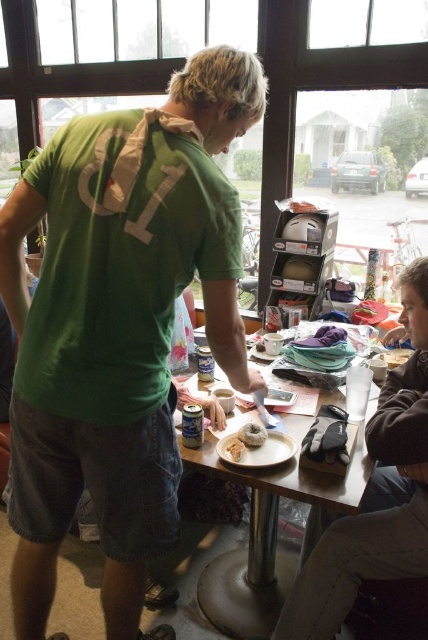
Who is lower down, green matte t-shirt at center or soft white bread at table center?

soft white bread at table center

Who is more forward, (109,632) or (255,429)?

Point (109,632)

You are a GUI agent. You are given a task and a screenshot of the screen. Output one action in this format:
    pyautogui.click(x=<x>, y=<y>)
    Task: Click on the green matte t-shirt at center
    This screenshot has height=640, width=428.
    Given the screenshot: What is the action you would take?
    pyautogui.click(x=118, y=324)

Does brown fuzzy sweater at lower right have a lesser height compared to smooth white bread at table center?

Incorrect, brown fuzzy sweater at lower right's height does not fall short of smooth white bread at table center's.

Is point (412, 429) behind point (229, 454)?

No, it is in front of (229, 454).

You are a GUI agent. You are given a task and a screenshot of the screen. Output one action in this format:
    pyautogui.click(x=<x>, y=<y>)
    Task: Click on the brown fuzzy sweater at lower right
    This screenshot has width=428, height=640.
    Given the screenshot: What is the action you would take?
    pyautogui.click(x=388, y=467)

Does wooden table at center have a greater height compared to white fluffy donut at center?

Indeed, wooden table at center has a greater height compared to white fluffy donut at center.

From the picture: Is wooden table at center to the right of white fluffy donut at center from the viewer's perspective?

Yes, wooden table at center is to the right of white fluffy donut at center.

At what (x,y) coordinates should I click in order to perform the action: click on wooden table at center. Please return your answer as a coordinate pair (x, y). The height and width of the screenshot is (640, 428). Looking at the image, I should click on (265, 532).